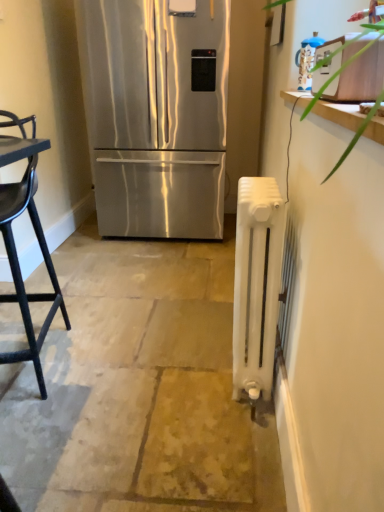
Question: Is white painted radiator at right touching blue glossy kettle at upper right?

Choices:
 (A) yes
 (B) no

Answer: (B)

Question: Considering the relative sizes of white painted radiator at right and blue glossy kettle at upper right in the image provided, is white painted radiator at right wider than blue glossy kettle at upper right?

Choices:
 (A) no
 (B) yes

Answer: (B)

Question: Can you confirm if white painted radiator at right is positioned to the left of blue glossy kettle at upper right?

Choices:
 (A) no
 (B) yes

Answer: (B)

Question: Is blue glossy kettle at upper right at the back of white painted radiator at right?

Choices:
 (A) yes
 (B) no

Answer: (B)

Question: From the image's perspective, is white painted radiator at right on top of blue glossy kettle at upper right?

Choices:
 (A) no
 (B) yes

Answer: (A)

Question: Choose the correct answer: Is black matte chair at left inside white painted radiator at right or outside it?

Choices:
 (A) outside
 (B) inside

Answer: (A)

Question: Considering the positions of black matte chair at left and white painted radiator at right in the image, is black matte chair at left taller or shorter than white painted radiator at right?

Choices:
 (A) tall
 (B) short

Answer: (A)

Question: Does point (21, 275) appear closer or farther from the camera than point (266, 318)?

Choices:
 (A) farther
 (B) closer

Answer: (A)

Question: Looking at the image, does black matte chair at left seem bigger or smaller compared to white painted radiator at right?

Choices:
 (A) big
 (B) small

Answer: (A)

Question: In the image, is blue glossy kettle at upper right positioned in front of or behind black matte chair at left?

Choices:
 (A) front
 (B) behind

Answer: (B)

Question: Considering the positions of point (309, 45) and point (16, 257), is point (309, 45) closer or farther from the camera than point (16, 257)?

Choices:
 (A) farther
 (B) closer

Answer: (B)

Question: Is blue glossy kettle at upper right to the left or to the right of black matte chair at left in the image?

Choices:
 (A) right
 (B) left

Answer: (A)

Question: In terms of width, does blue glossy kettle at upper right look wider or thinner when compared to black matte chair at left?

Choices:
 (A) wide
 (B) thin

Answer: (B)

Question: Considering the positions of point (271, 195) and point (200, 74), is point (271, 195) closer or farther from the camera than point (200, 74)?

Choices:
 (A) farther
 (B) closer

Answer: (B)

Question: Visually, is white painted radiator at right positioned to the left or to the right of stainless steel refrigerator at center?

Choices:
 (A) right
 (B) left

Answer: (A)